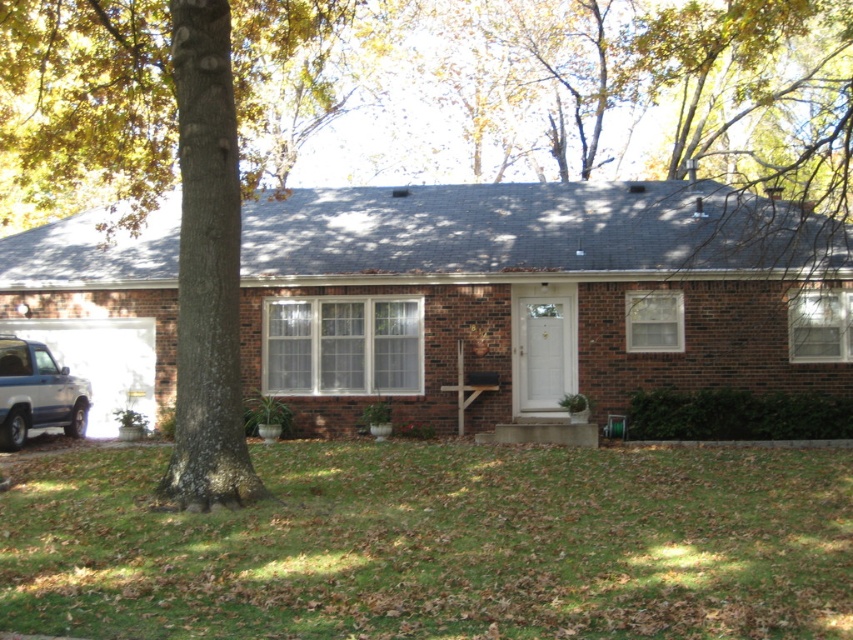
Does green grass at lower center have a greater height compared to satin silver suv at lower left?

No, green grass at lower center is not taller than satin silver suv at lower left.

Between green grass at lower center and satin silver suv at lower left, which one appears on the right side from the viewer's perspective?

green grass at lower center is more to the right.

Image resolution: width=853 pixels, height=640 pixels. Describe the element at coordinates (438, 545) in the screenshot. I see `green grass at lower center` at that location.

Where is `green grass at lower center`? green grass at lower center is located at coordinates (438, 545).